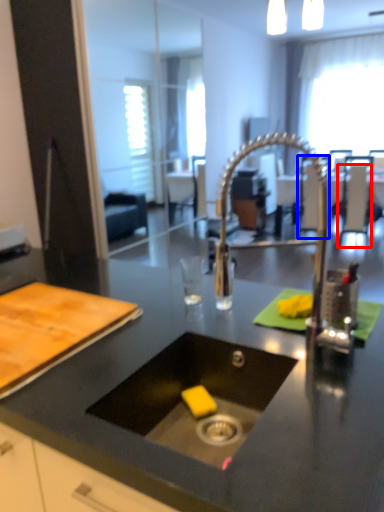
Question: Which object is closer to the camera taking this photo, chair (highlighted by a red box) or chair (highlighted by a blue box)?

Choices:
 (A) chair
 (B) chair

Answer: (A)